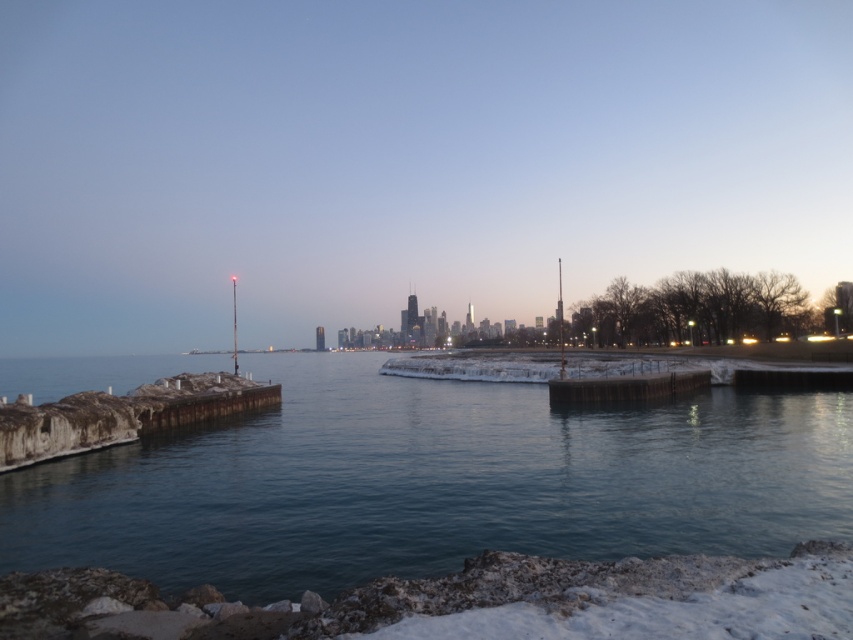
Question: Which of the following is the closest to the observer?

Choices:
 (A) smooth concrete piers at lower left
 (B) wooden dock at center

Answer: (A)

Question: Which point appears closest to the camera in this image?

Choices:
 (A) (285, 365)
 (B) (88, 438)
 (C) (631, 380)

Answer: (B)

Question: Is smooth concrete piers at lower left to the right of wooden dock at center from the viewer's perspective?

Choices:
 (A) no
 (B) yes

Answer: (A)

Question: Among these points, which one is farthest from the camera?

Choices:
 (A) click(x=686, y=372)
 (B) click(x=109, y=392)
 (C) click(x=172, y=464)

Answer: (A)

Question: Can you confirm if smooth concrete piers at lower left is positioned to the right of rusty wood dock at lower left?

Choices:
 (A) yes
 (B) no

Answer: (B)

Question: Can you confirm if smooth concrete piers at lower left is smaller than wooden dock at center?

Choices:
 (A) yes
 (B) no

Answer: (B)